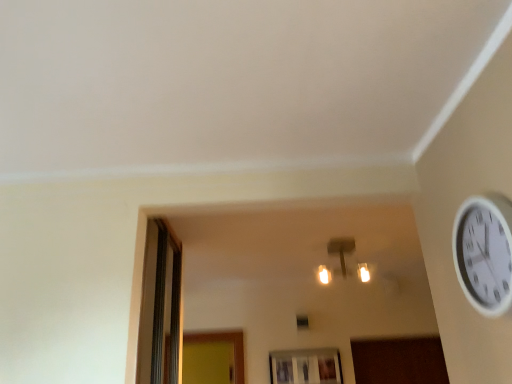
Question: Would you say white plastic wall clock at upper right is inside or outside transparent glass window at lower center?

Choices:
 (A) inside
 (B) outside

Answer: (B)

Question: Relative to transparent glass window at lower center, is white plastic wall clock at upper right in front or behind?

Choices:
 (A) behind
 (B) front

Answer: (B)

Question: Which of these objects is positioned closest to the matte gold light fixture at center?

Choices:
 (A) white plastic wall clock at upper right
 (B) transparent glass window at lower center

Answer: (B)

Question: Estimate the real-world distances between objects in this image. Which object is closer to the white plastic wall clock at upper right?

Choices:
 (A) matte gold light fixture at center
 (B) transparent glass window at lower center

Answer: (A)